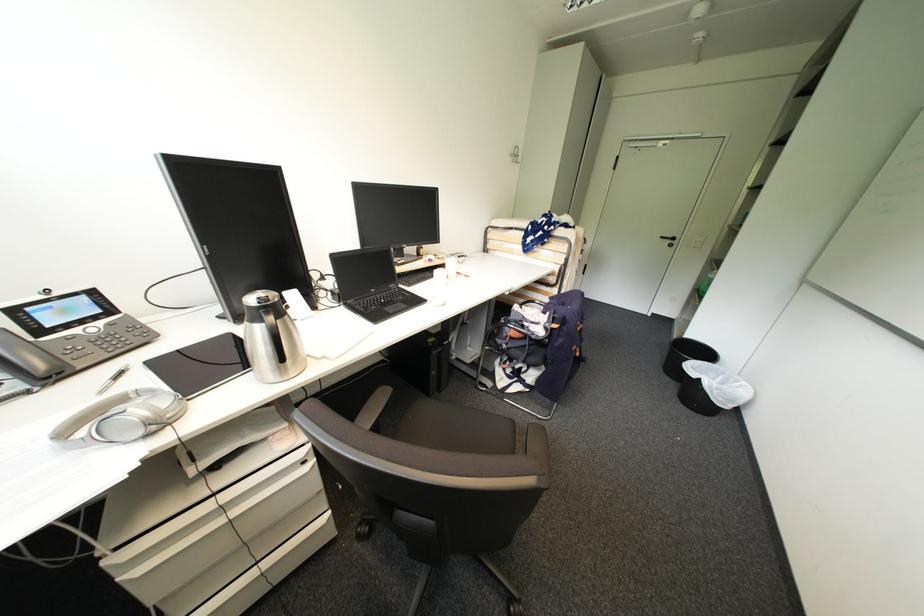
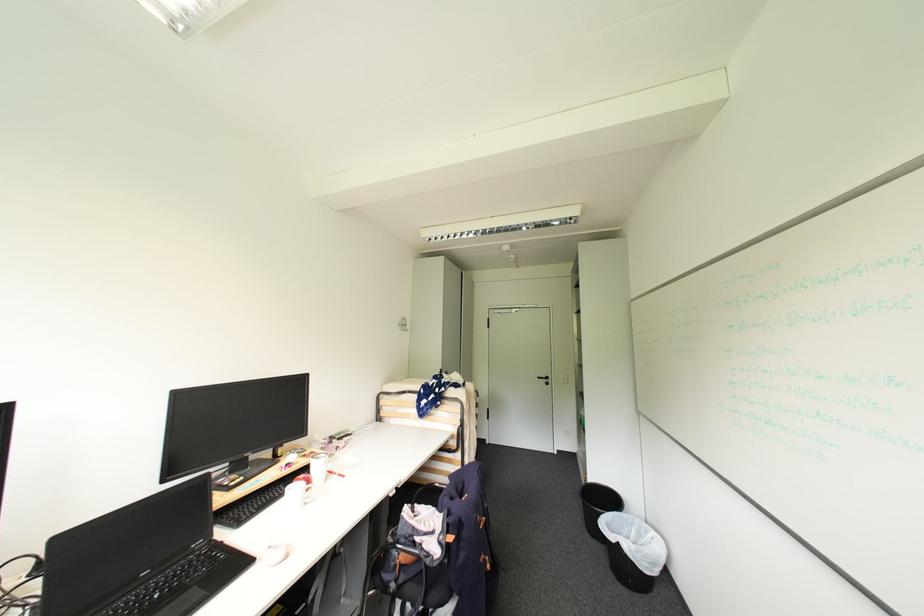
In the second image, find the point that corresponds to point 517,156 in the first image.

(406, 325)